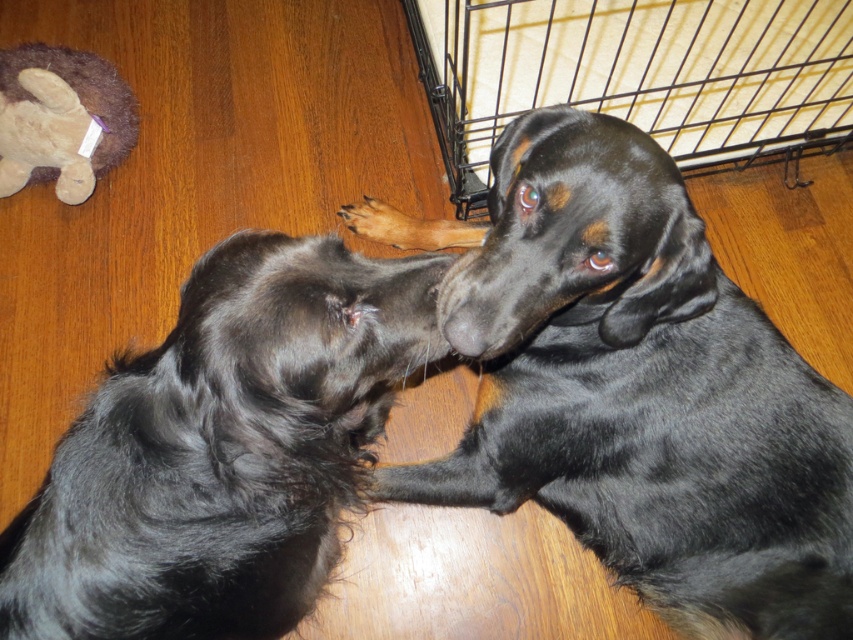
Consider the image. You are a dog owner who wants to give your dog a toy. You see the shiny black fur at center and the fuzzy brown stuffed animal at upper left. Which one is the toy?

The fuzzy brown stuffed animal at upper left is the toy because it is smaller in size than the shiny black fur at center, which is likely a dog.

You are a photographer trying to capture a closeup of the black shiny fur dog at center. You notice a point marked at coordinates (636, 387). Is this point located on the black shiny fur dog at center?

Yes, the point marked at coordinates (636, 387) is located on the black shiny fur dog at center.

You are a dog owner who wants to retrieve the fuzzy brown stuffed animal at upper left for your dog. Based on the scene, can you reach the stuffed animal without stepping over the shiny black fur at center?

The shiny black fur at center is positioned under the fuzzy brown stuffed animal at upper left, so you can reach the fuzzy brown stuffed animal at upper left without stepping over the shiny black fur at center by moving around it.